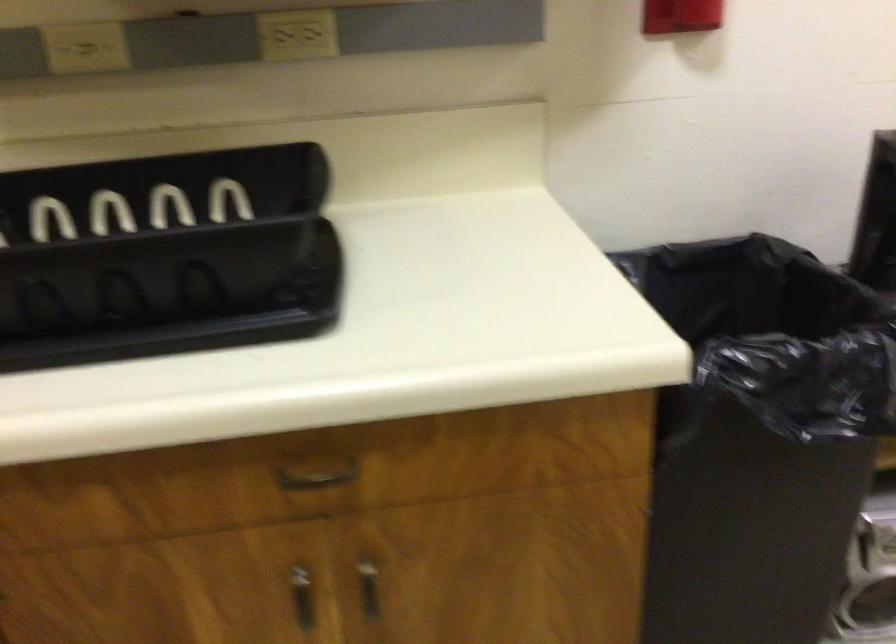
I want to click on metal drawer handle, so click(315, 471).